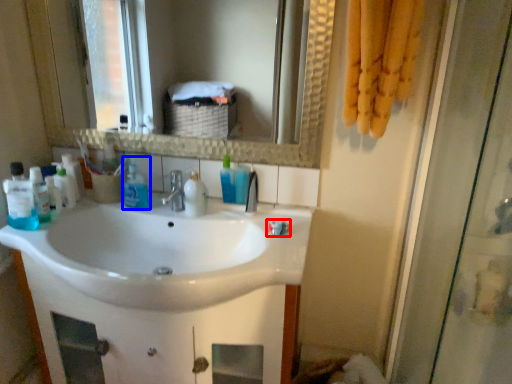
Question: Among these objects, which one is nearest to the camera, toothpaste (highlighted by a red box) or cleaning product (highlighted by a blue box)?

Choices:
 (A) toothpaste
 (B) cleaning product

Answer: (A)